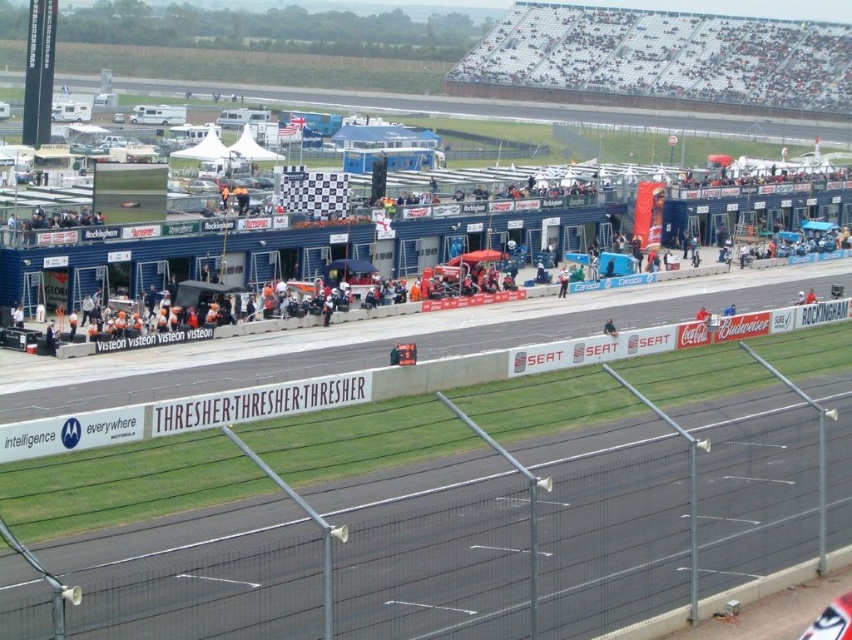
Does point (334, 397) lie in front of point (562, 284)?

Yes, it is in front of point (562, 284).

Describe the element at coordinates (257, 403) in the screenshot. I see `white plastic banner at center` at that location.

Locate an element on the screen. This screenshot has height=640, width=852. white plastic banner at center is located at coordinates (257, 403).

Image resolution: width=852 pixels, height=640 pixels. I want to click on white plastic banner at center, so tap(257, 403).